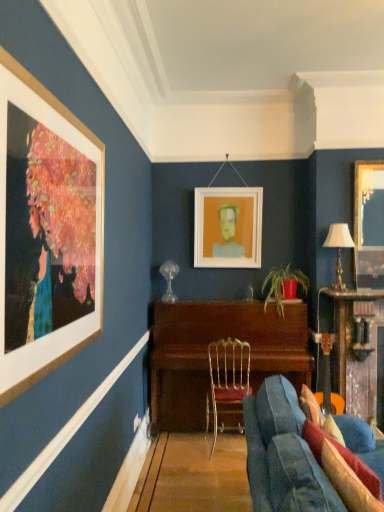
Question: Is wooden piano at center, positioned as the 2th table in right-to-left order, smaller than gold metallic chair at center?

Choices:
 (A) yes
 (B) no

Answer: (B)

Question: Is wooden piano at center, placed as the first table when sorted from left to right, positioned with its back to gold metallic chair at center?

Choices:
 (A) no
 (B) yes

Answer: (B)

Question: Is wooden piano at center, placed as the first table when sorted from left to right, not near gold metallic chair at center?

Choices:
 (A) no
 (B) yes

Answer: (A)

Question: Is wooden piano at center, placed as the first table when sorted from left to right, positioned behind gold metallic chair at center?

Choices:
 (A) yes
 (B) no

Answer: (A)

Question: Is wooden piano at center, positioned as the 2th table in right-to-left order, outside of gold metallic chair at center?

Choices:
 (A) no
 (B) yes

Answer: (B)

Question: Could you tell me if wooden piano at center, positioned as the 2th table in right-to-left order, is turned towards gold metallic chair at center?

Choices:
 (A) no
 (B) yes

Answer: (B)

Question: Considering the relative sizes of gold-framed mirror at upper right, which is counted as the second picture frame, starting from the back, and gold metallic table lamp at right in the image provided, is gold-framed mirror at upper right, which is counted as the second picture frame, starting from the back, wider than gold metallic table lamp at right?

Choices:
 (A) yes
 (B) no

Answer: (B)

Question: From a real-world perspective, is gold-framed mirror at upper right, acting as the second picture frame starting from the left, positioned under gold metallic table lamp at right based on gravity?

Choices:
 (A) yes
 (B) no

Answer: (B)

Question: Considering the relative positions of gold-framed mirror at upper right, which is counted as the first picture frame, starting from the front, and gold metallic table lamp at right in the image provided, is gold-framed mirror at upper right, which is counted as the first picture frame, starting from the front, in front of gold metallic table lamp at right?

Choices:
 (A) no
 (B) yes

Answer: (A)

Question: Is gold-framed mirror at upper right, which is counted as the second picture frame, starting from the back, positioned with its back to gold metallic table lamp at right?

Choices:
 (A) no
 (B) yes

Answer: (A)

Question: Would you say gold-framed mirror at upper right, acting as the second picture frame starting from the left, contains gold metallic table lamp at right?

Choices:
 (A) no
 (B) yes

Answer: (A)

Question: Is gold-framed mirror at upper right, which is counted as the first picture frame, starting from the front, to the left of gold metallic table lamp at right from the viewer's perspective?

Choices:
 (A) no
 (B) yes

Answer: (A)

Question: Does wooden table at right, the 1th table viewed from the right, appear on the right side of wooden piano at center, positioned as the 2th table in right-to-left order?

Choices:
 (A) yes
 (B) no

Answer: (A)